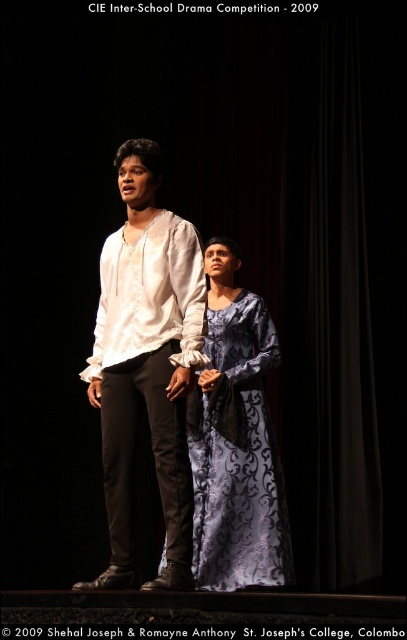
Question: Where is matte white shirt at center located in relation to silvery blue dress at center in the image?

Choices:
 (A) right
 (B) left

Answer: (B)

Question: Is matte white shirt at center smaller than silvery blue dress at center?

Choices:
 (A) no
 (B) yes

Answer: (A)

Question: Which point is farther from the camera taking this photo?

Choices:
 (A) (153, 326)
 (B) (280, 490)

Answer: (B)

Question: Which of the following is the farthest from the observer?

Choices:
 (A) (264, 564)
 (B) (126, 179)

Answer: (A)

Question: Does matte white shirt at center appear over silvery blue dress at center?

Choices:
 (A) yes
 (B) no

Answer: (A)